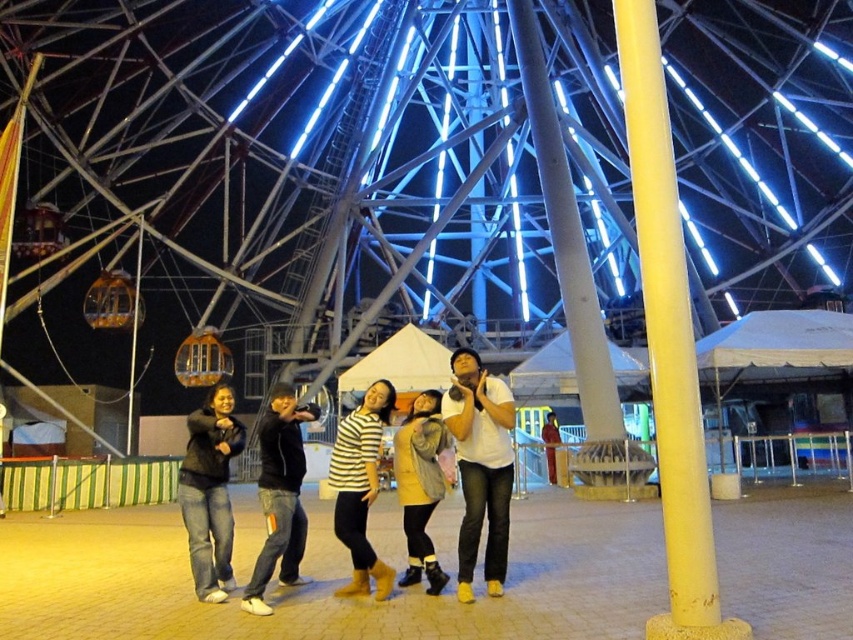
Between black denim jeans at center and striped shirt at center, which one appears on the left side from the viewer's perspective?

black denim jeans at center

Does black denim jeans at center appear over striped shirt at center?

Indeed, black denim jeans at center is positioned over striped shirt at center.

In order to click on black denim jeans at center in this screenshot , I will do `click(280, 496)`.

Between yellow matte pole at right and black denim jeans at center, which one appears on the left side from the viewer's perspective?

black denim jeans at center

Locate an element on the screen. Image resolution: width=853 pixels, height=640 pixels. yellow matte pole at right is located at coordinates click(668, 339).

Where is `yellow matte pole at right`? yellow matte pole at right is located at coordinates (668, 339).

Which is more to the right, denim jeans at lower left or striped shirt at center?

Positioned to the right is striped shirt at center.

Who is more distant from viewer, (213, 412) or (386, 416)?

Point (386, 416)

Identify the location of denim jeans at lower left. coord(209,492).